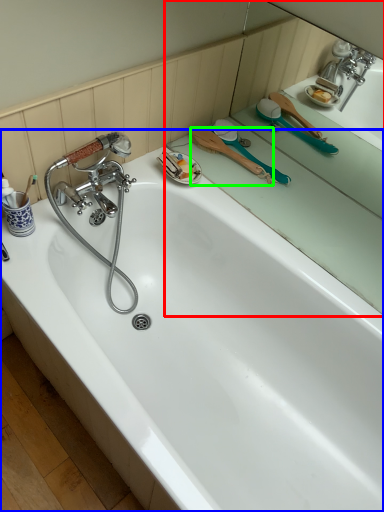
Question: Estimate the real-world distances between objects in this image. Which object is farther from mirror (highlighted by a red box), bathtub (highlighted by a blue box) or brush (highlighted by a green box)?

Choices:
 (A) bathtub
 (B) brush

Answer: (A)